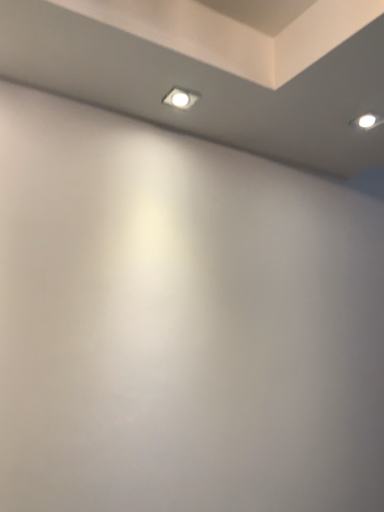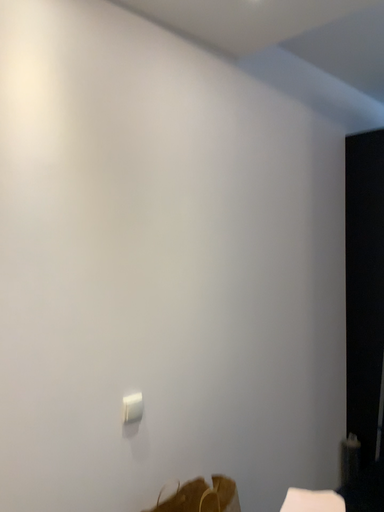
Question: How did the camera likely rotate when shooting the video?

Choices:
 (A) rotated downward
 (B) rotated upward

Answer: (A)